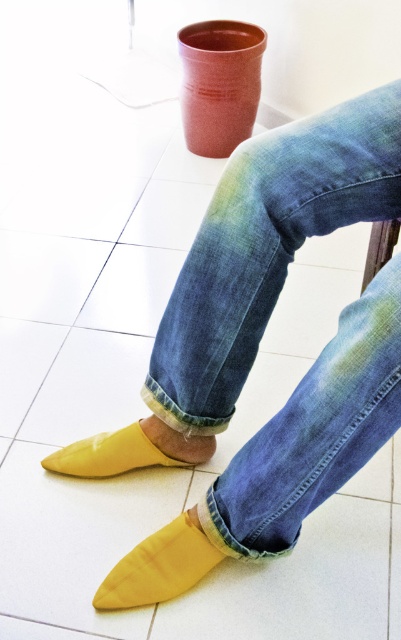
You are standing in a room and see two points marked in the image. Which point is closer to you, point (x=263, y=513) or point (x=172, y=595)?

Point (x=263, y=513) is closer to the viewer than point (x=172, y=595).

You are a photographer adjusting your camera settings to capture the yellow fabric socks at lower left. Given that the camera is focused at 30 inches, will the socks be in sharp focus?

The yellow fabric socks at lower left are 29.97 inches away from the camera, which is almost exactly at the 30 inch focus distance. Therefore, the socks should be in sharp focus.

You are a photographer setting up a shoot in this scene. You need to place a small prop between the yellow fabric socks at lower left and the denim at center. Where should you place it to ensure it is visible in the frame?

Place the prop between the yellow fabric socks at lower left and the denim at center. Since the yellow fabric socks at lower left is positioned under denim at center, the prop should be placed above the yellow fabric socks at lower left to ensure visibility between them.